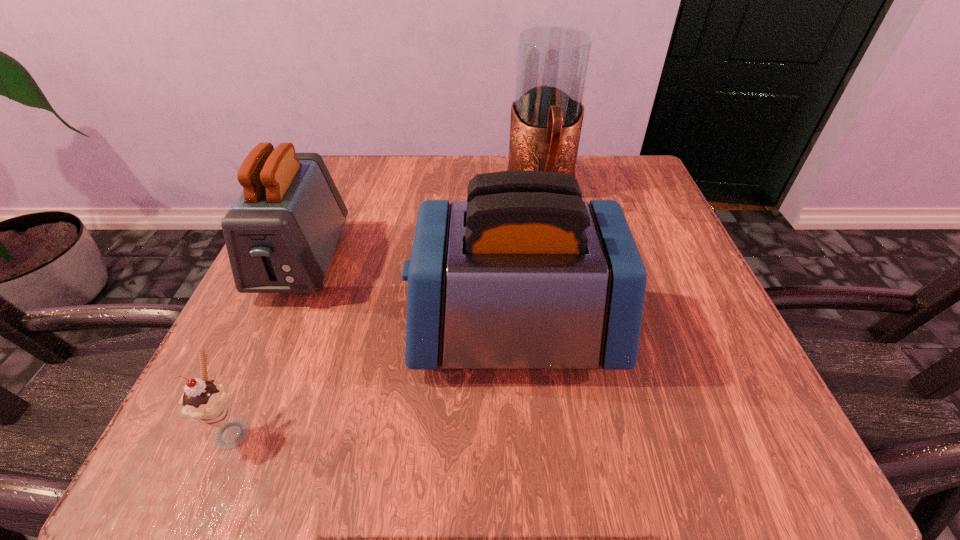
I want to click on the second closest object relative to the third tallest object, so click(205, 401).

At what (x,y) coordinates should I click in order to perform the action: click on object that stands as the second closest to the third tallest object. Please return your answer as a coordinate pair (x, y). Looking at the image, I should click on (205, 401).

The width and height of the screenshot is (960, 540). I want to click on free space that satisfies the following two spatial constraints: 1. with the handle on the side of the pitcher; 2. on the front-facing side of the taller toaster, so click(566, 332).

Identify the location of vacant space that satisfies the following two spatial constraints: 1. with the handle on the side of the farthest object; 2. on the front-facing side of the second tallest object. Image resolution: width=960 pixels, height=540 pixels. (566, 332).

I want to click on free space that satisfies the following two spatial constraints: 1. on the front-facing side of the left toaster; 2. on the right side of the shortest object, so click(230, 428).